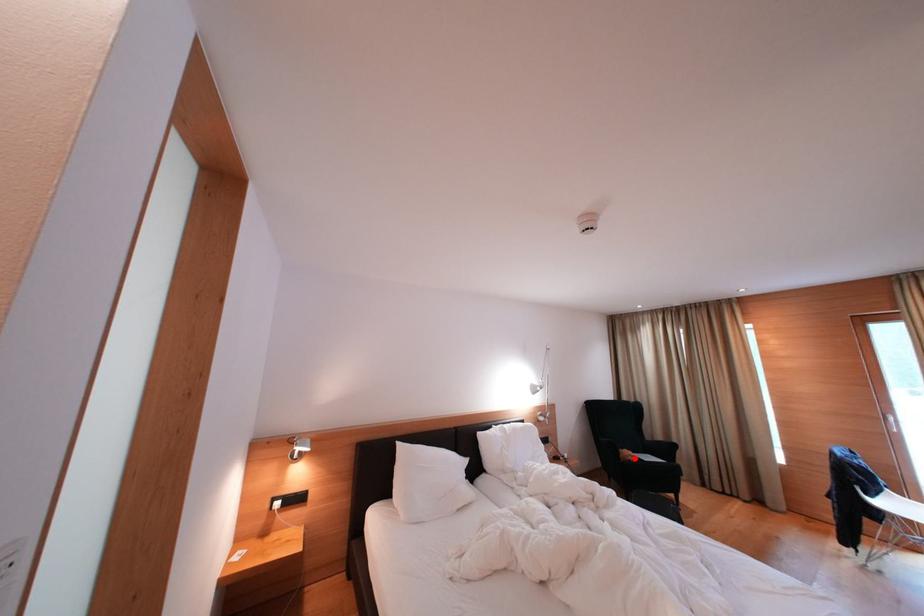
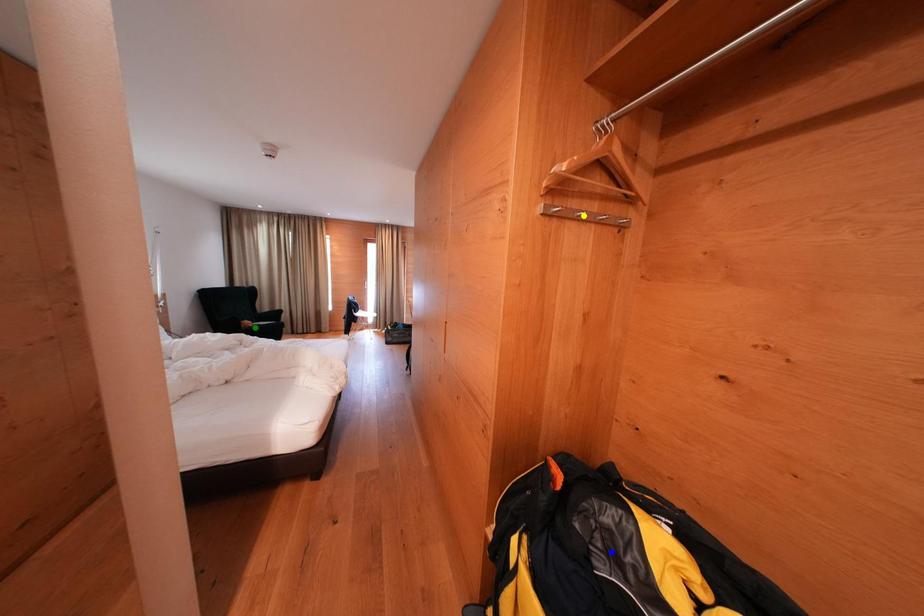
Question: I am providing you with two images of the same scene from different viewpoints. A red point is marked on the first image. You are given multiple points on the second image. Can you choose the point in image 2 that corresponds to the point in image 1?

Choices:
 (A) yellow point
 (B) blue point
 (C) green point

Answer: (C)